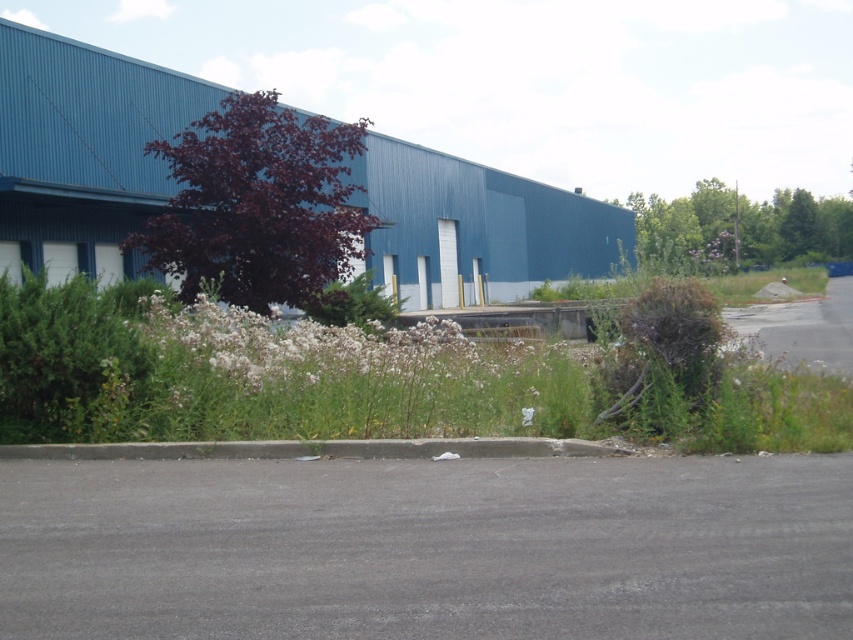
You are a gardener assessing the plants in the industrial area. You see the white fluffy flowers at center and the green grass at center. Which one is shorter?

The white fluffy flowers at center is not as tall as green grass at center, so the white fluffy flowers at center is shorter.

You are a gardener who wants to plant new flowers in the industrial area. You have a limited space of 10 square feet. Which object between the white fluffy flowers at center and the green grass at center would you choose to plant if you want to maximize the number of plants in that space?

The white fluffy flowers at center has a smaller size compared to green grass at center, so planting white fluffy flowers at center would allow you to fit more plants in the limited 10 square feet space.